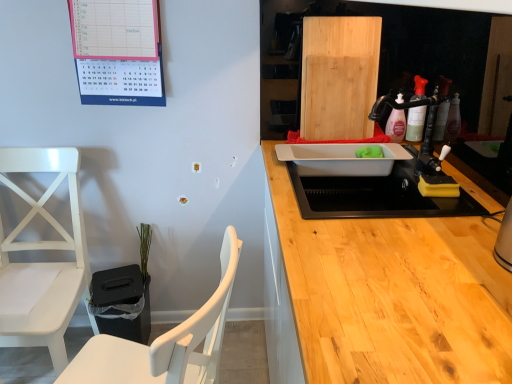
Question: Does white wood chair at left, placed as the 1th chair when sorted from right to left, have a larger size compared to pink paper calendar at upper left?

Choices:
 (A) no
 (B) yes

Answer: (B)

Question: Is white wood chair at left, which ranks as the 2th chair in left-to-right order, shorter than pink paper calendar at upper left?

Choices:
 (A) yes
 (B) no

Answer: (B)

Question: Is the surface of white wood chair at left, which ranks as the 2th chair in left-to-right order, in direct contact with pink paper calendar at upper left?

Choices:
 (A) no
 (B) yes

Answer: (A)

Question: Is white wood chair at left, which ranks as the 2th chair in left-to-right order, completely or partially outside of pink paper calendar at upper left?

Choices:
 (A) no
 (B) yes

Answer: (B)

Question: Does white wood chair at left, which ranks as the 2th chair in left-to-right order, have a greater height compared to pink paper calendar at upper left?

Choices:
 (A) no
 (B) yes

Answer: (B)

Question: Is white plastic sink at center, which is counted as the 1th sink, starting from the front, in front of or behind white wood chair at left, which ranks as the 2th chair in left-to-right order, in the image?

Choices:
 (A) front
 (B) behind

Answer: (B)

Question: Considering the positions of white plastic sink at center, which is counted as the 1th sink, starting from the front, and white wood chair at left, which ranks as the 2th chair in left-to-right order, in the image, is white plastic sink at center, which is counted as the 1th sink, starting from the front, wider or thinner than white wood chair at left, which ranks as the 2th chair in left-to-right order,?

Choices:
 (A) wide
 (B) thin

Answer: (B)

Question: In the image, is white plastic sink at center, which is counted as the 1th sink, starting from the front, on the left side or the right side of white wood chair at left, placed as the 1th chair when sorted from right to left?

Choices:
 (A) left
 (B) right

Answer: (B)

Question: From a real-world perspective, relative to white wood chair at left, placed as the 1th chair when sorted from right to left, is white plastic sink at center, which is counted as the 1th sink, starting from the front, vertically above or below?

Choices:
 (A) below
 (B) above

Answer: (B)

Question: From a real-world perspective, is pink paper calendar at upper left above or below white plastic sink at center, which is counted as the 1th sink, starting from the front?

Choices:
 (A) below
 (B) above

Answer: (B)

Question: Choose the correct answer: Is pink paper calendar at upper left inside white plastic sink at center, which is counted as the 1th sink, starting from the front, or outside it?

Choices:
 (A) outside
 (B) inside

Answer: (A)

Question: Looking at their shapes, would you say pink paper calendar at upper left is wider or thinner than white plastic sink at center, which is counted as the 1th sink, starting from the front?

Choices:
 (A) thin
 (B) wide

Answer: (A)

Question: From the image's perspective, relative to white plastic sink at center, the 2th sink from the back, is pink paper calendar at upper left above or below?

Choices:
 (A) above
 (B) below

Answer: (A)

Question: Looking at the image, does natural wood cutting board at upper right seem bigger or smaller compared to pink paper calendar at upper left?

Choices:
 (A) big
 (B) small

Answer: (A)

Question: Is natural wood cutting board at upper right wider or thinner than pink paper calendar at upper left?

Choices:
 (A) thin
 (B) wide

Answer: (B)